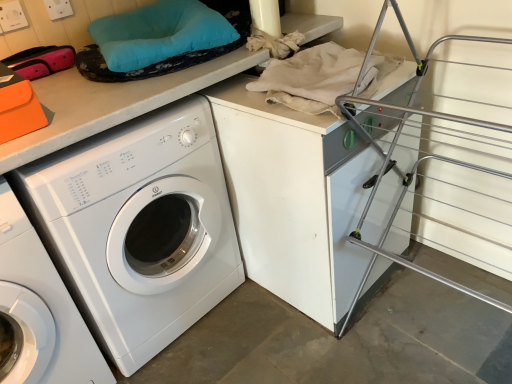
Question: Which direction should I rotate to look at white glossy washing machine at center, acting as the second washing machine starting from the right?

Choices:
 (A) left
 (B) right

Answer: (A)

Question: From a real-world perspective, is white glossy washing machine at center, the 1th washing machine in the left-to-right sequence, over white glossy washing machine at center, positioned as the 1th washing machine in right-to-left order?

Choices:
 (A) yes
 (B) no

Answer: (B)

Question: Considering the relative sizes of white glossy washing machine at center, the 1th washing machine in the left-to-right sequence, and white glossy washing machine at center, placed as the second washing machine when sorted from left to right, in the image provided, is white glossy washing machine at center, the 1th washing machine in the left-to-right sequence, thinner than white glossy washing machine at center, placed as the second washing machine when sorted from left to right,?

Choices:
 (A) yes
 (B) no

Answer: (A)

Question: Is white glossy washing machine at center, acting as the second washing machine starting from the right, oriented towards white glossy washing machine at center, placed as the second washing machine when sorted from left to right?

Choices:
 (A) yes
 (B) no

Answer: (B)

Question: Does white glossy washing machine at center, the 1th washing machine in the left-to-right sequence, appear on the right side of white glossy washing machine at center, positioned as the 1th washing machine in right-to-left order?

Choices:
 (A) yes
 (B) no

Answer: (B)

Question: Does white glossy washing machine at center, acting as the second washing machine starting from the right, have a smaller size compared to white glossy washing machine at center, positioned as the 1th washing machine in right-to-left order?

Choices:
 (A) yes
 (B) no

Answer: (A)

Question: Is white glossy washing machine at center, placed as the second washing machine when sorted from left to right, at the back of white glossy washing machine at center, the 1th washing machine in the left-to-right sequence?

Choices:
 (A) no
 (B) yes

Answer: (A)

Question: Considering the relative positions of white glossy washing machine at center, placed as the second washing machine when sorted from left to right, and white glossy washing machine at center, the 1th washing machine in the left-to-right sequence, in the image provided, is white glossy washing machine at center, placed as the second washing machine when sorted from left to right, to the right of white glossy washing machine at center, the 1th washing machine in the left-to-right sequence, from the viewer's perspective?

Choices:
 (A) no
 (B) yes

Answer: (B)

Question: Can you confirm if white glossy washing machine at center, placed as the second washing machine when sorted from left to right, is thinner than white glossy washing machine at center, the 1th washing machine in the left-to-right sequence?

Choices:
 (A) no
 (B) yes

Answer: (A)

Question: Is white glossy washing machine at center, placed as the second washing machine when sorted from left to right, next to white glossy washing machine at center, the 1th washing machine in the left-to-right sequence, and touching it?

Choices:
 (A) yes
 (B) no

Answer: (B)

Question: Is white glossy washing machine at center, acting as the second washing machine starting from the right, located within white glossy washing machine at center, placed as the second washing machine when sorted from left to right?

Choices:
 (A) no
 (B) yes

Answer: (A)

Question: From a real-world perspective, is white glossy washing machine at center, placed as the second washing machine when sorted from left to right, below white glossy washing machine at center, acting as the second washing machine starting from the right?

Choices:
 (A) no
 (B) yes

Answer: (A)

Question: Is white glossy washing machine at center, positioned as the 1th washing machine in right-to-left order, positioned with its back to white glossy washing machine at center, acting as the second washing machine starting from the right?

Choices:
 (A) yes
 (B) no

Answer: (B)

Question: Is white glossy washing machine at center, the 1th washing machine in the left-to-right sequence, in front of or behind white glossy washing machine at center, placed as the second washing machine when sorted from left to right, in the image?

Choices:
 (A) behind
 (B) front

Answer: (B)